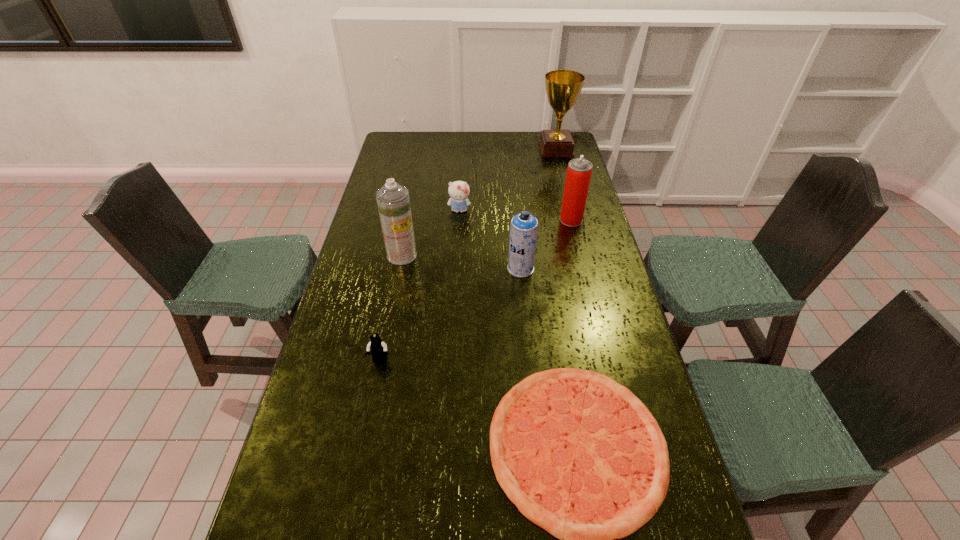
Identify the location of free space between the farthest object and the leftmost aerosol can. (479, 202).

Where is `empty location between the sixth tallest object and the farthest object`? Image resolution: width=960 pixels, height=540 pixels. empty location between the sixth tallest object and the farthest object is located at coordinates (468, 254).

The height and width of the screenshot is (540, 960). I want to click on object that is the third closest to the rightmost aerosol can, so click(563, 87).

What are the coordinates of `the fifth closest object to the award` in the screenshot? It's located at (557, 429).

Locate an element on the screen. Image resolution: width=960 pixels, height=540 pixels. aerosol can that is the second nearest to the shortest object is located at coordinates (393, 201).

This screenshot has width=960, height=540. Identify the location of aerosol can that can be found as the closest to the farthest aerosol can. (524, 227).

Identify the location of blank area in the image that satisfies the following two spatial constraints: 1. on the front-facing side of the shortest aerosol can; 2. on the right side of the third shortest object. (456, 268).

Where is `vacant space that satisfies the following two spatial constraints: 1. on the plaque of the farthest object; 2. on the front-facing side of the Lego`? The height and width of the screenshot is (540, 960). vacant space that satisfies the following two spatial constraints: 1. on the plaque of the farthest object; 2. on the front-facing side of the Lego is located at coordinates (610, 360).

Where is `free space that satisfies the following two spatial constraints: 1. on the plaque of the award; 2. on the front side of the leftmost aerosol can`? free space that satisfies the following two spatial constraints: 1. on the plaque of the award; 2. on the front side of the leftmost aerosol can is located at coordinates (583, 255).

Find the location of a particular element. blank space that satisfies the following two spatial constraints: 1. on the front-facing side of the rightmost aerosol can; 2. on the right side of the fifth tallest object is located at coordinates (459, 220).